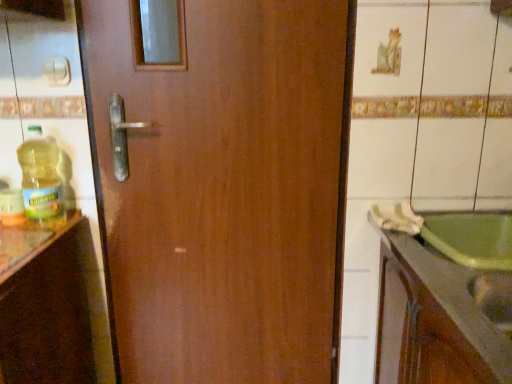
Describe the element at coordinates (41, 180) in the screenshot. I see `translucent plastic bottle at left` at that location.

Measure the distance between point (60, 218) and camera.

The depth of point (60, 218) is 4.13 feet.

Identify the location of translucent plastic bottle at left. This screenshot has height=384, width=512. (41, 180).

Locate an element on the screen. green glossy sink at lower right is located at coordinates point(440,317).

The width and height of the screenshot is (512, 384). Describe the element at coordinates (440, 317) in the screenshot. I see `green glossy sink at lower right` at that location.

What are the coordinates of `translucent plastic bottle at left` in the screenshot? It's located at (41, 180).

Does green glossy sink at lower right appear on the left side of translucent plastic bottle at left?

Incorrect, green glossy sink at lower right is not on the left side of translucent plastic bottle at left.

Is green glossy sink at lower right positioned behind translucent plastic bottle at left?

That is False.

Is point (470, 313) closer to viewer compared to point (50, 224)?

Yes, it is.

From the image's perspective, is green glossy sink at lower right located beneath translucent plastic bottle at left?

Correct, green glossy sink at lower right appears lower than translucent plastic bottle at left in the image.

From a real-world perspective, is green glossy sink at lower right below translucent plastic bottle at left?

Yes, from a real-world perspective, green glossy sink at lower right is under translucent plastic bottle at left.

Based on the photo, considering the relative sizes of green glossy sink at lower right and translucent plastic bottle at left in the image provided, is green glossy sink at lower right thinner than translucent plastic bottle at left?

Incorrect, the width of green glossy sink at lower right is not less than that of translucent plastic bottle at left.

Can you confirm if green glossy sink at lower right is taller than translucent plastic bottle at left?

In fact, green glossy sink at lower right may be shorter than translucent plastic bottle at left.

Considering the sizes of objects green glossy sink at lower right and translucent plastic bottle at left in the image provided, who is bigger, green glossy sink at lower right or translucent plastic bottle at left?

green glossy sink at lower right.

Can translucent plastic bottle at left be found inside green glossy sink at lower right?

No, green glossy sink at lower right does not contain translucent plastic bottle at left.

Is green glossy sink at lower right beside translucent plastic bottle at left?

No, green glossy sink at lower right is not next to translucent plastic bottle at left.

Is green glossy sink at lower right aimed at translucent plastic bottle at left?

Yes.

In the scene shown: How different are the orientations of green glossy sink at lower right and translucent plastic bottle at left in degrees?

green glossy sink at lower right and translucent plastic bottle at left are facing 90 degrees away from each other.

How far apart are green glossy sink at lower right and translucent plastic bottle at left?

A distance of 3.41 feet exists between green glossy sink at lower right and translucent plastic bottle at left.

The width and height of the screenshot is (512, 384). What are the coordinates of `bottle positioned vertically above the green glossy sink at lower right (from a real-world perspective)` in the screenshot? It's located at (41, 180).

Is translucent plastic bottle at left to the left of green glossy sink at lower right from the viewer's perspective?

Correct, you'll find translucent plastic bottle at left to the left of green glossy sink at lower right.

Is translucent plastic bottle at left in front of or behind green glossy sink at lower right in the image?

In the image, translucent plastic bottle at left appears behind green glossy sink at lower right.

Which is less distant, (30, 165) or (490, 378)?

Point (30, 165) is positioned farther from the camera compared to point (490, 378).

From the image's perspective, is translucent plastic bottle at left above green glossy sink at lower right?

Yes, from the image's perspective, translucent plastic bottle at left is above green glossy sink at lower right.

From a real-world perspective, is translucent plastic bottle at left physically located above or below green glossy sink at lower right?

translucent plastic bottle at left is above green glossy sink at lower right.

Does translucent plastic bottle at left have a greater width compared to green glossy sink at lower right?

Incorrect, the width of translucent plastic bottle at left does not surpass that of green glossy sink at lower right.

Considering the relative sizes of translucent plastic bottle at left and green glossy sink at lower right in the image provided, is translucent plastic bottle at left taller than green glossy sink at lower right?

Indeed, translucent plastic bottle at left has a greater height compared to green glossy sink at lower right.

Which of these two, translucent plastic bottle at left or green glossy sink at lower right, is smaller?

translucent plastic bottle at left.

Is green glossy sink at lower right surrounded by translucent plastic bottle at left?

No, translucent plastic bottle at left does not contain green glossy sink at lower right.

Are translucent plastic bottle at left and green glossy sink at lower right beside each other?

No, translucent plastic bottle at left is not next to green glossy sink at lower right.

Is translucent plastic bottle at left looking in the opposite direction of green glossy sink at lower right?

No, green glossy sink at lower right is not at the back of translucent plastic bottle at left.

The image size is (512, 384). What are the coordinates of `countertop below the translucent plastic bottle at left (from a real-world perspective)` in the screenshot? It's located at (440, 317).

At what (x,y) coordinates should I click in order to perform the action: click on countertop in front of the translucent plastic bottle at left. Please return your answer as a coordinate pair (x, y). The height and width of the screenshot is (384, 512). Looking at the image, I should click on (440, 317).

Locate an element on the screen. The height and width of the screenshot is (384, 512). bottle lying behind the green glossy sink at lower right is located at coordinates (41, 180).